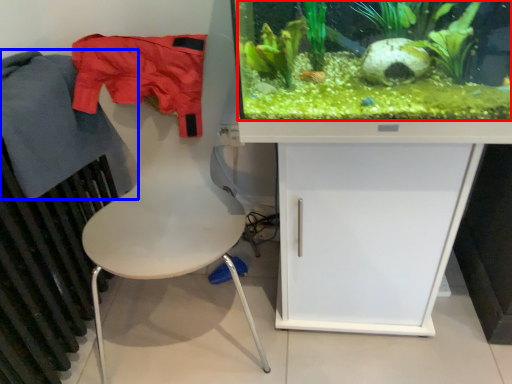
Question: Which point is closer to the camera, plant (highlighted by a red box) or clothing (highlighted by a blue box)?

Choices:
 (A) plant
 (B) clothing

Answer: (A)